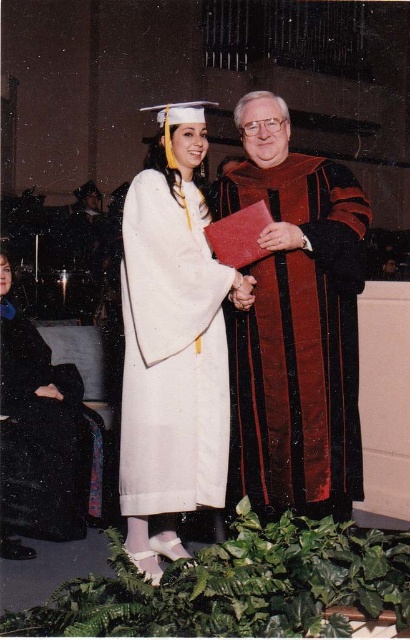
You are a photographer at the graduation ceremony. You need to capture a photo where both the velvet maroon gown at center and the black matte robe at lower left are visible. Considering their heights, which one should you position closer to the camera to ensure both are fully visible in the frame?

The velvet maroon gown at center is much taller than the black matte robe at lower left. To ensure both are fully visible, position the black matte robe at lower left closer to the camera so that its shorter height doesn